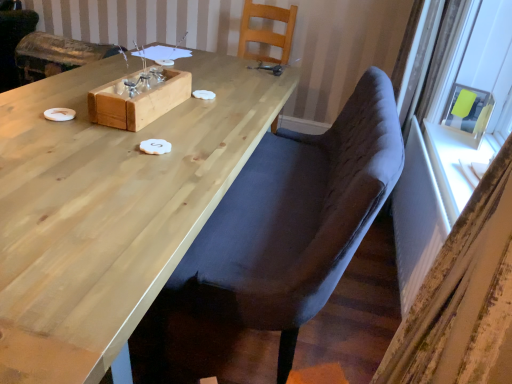
Question: Relative to wooden box at center, is velvet grey chair at center, the 2th chair from the back, in front or behind?

Choices:
 (A) front
 (B) behind

Answer: (A)

Question: Which is correct: velvet grey chair at center, arranged as the first chair when viewed from the front, is inside wooden box at center, or outside of it?

Choices:
 (A) inside
 (B) outside

Answer: (B)

Question: Which object is positioned closest to the velvet grey chair at center, the 2th chair from the back?

Choices:
 (A) wooden box at center
 (B) yellow paper at upper right
 (C) wooden chair at upper center, arranged as the 1th chair when viewed from the back
 (D) wooden armchair at upper left
 (E) satin gray curtain at right

Answer: (E)

Question: Which object is positioned closest to the wooden armchair at upper left?

Choices:
 (A) wooden chair at upper center, placed as the 2th chair when sorted from front to back
 (B) velvet grey chair at center, the 2th chair from the back
 (C) natural wood table at center
 (D) satin gray curtain at right
 (E) wooden box at center

Answer: (A)